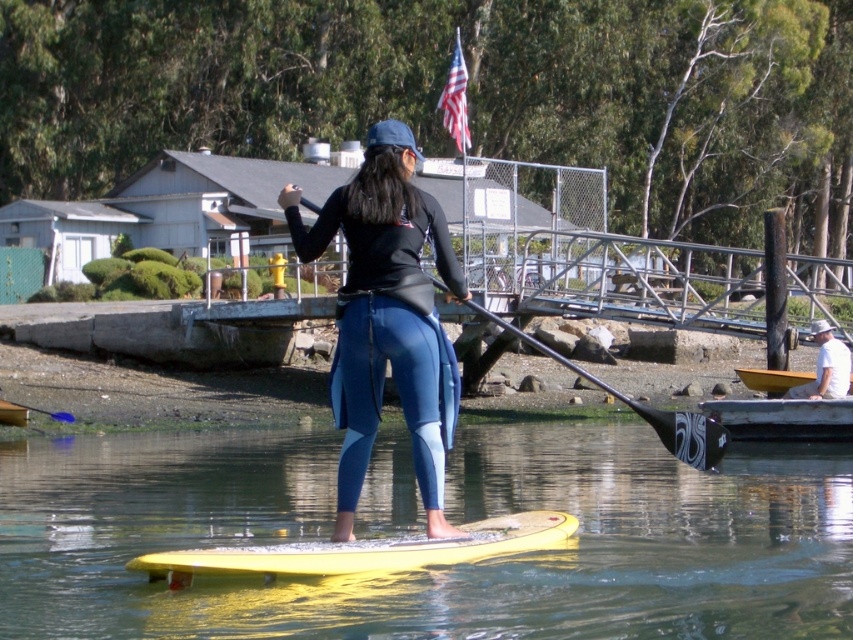
Looking at this image, which is more to the right, yellow rubber paddleboard at center or matte black wetsuit at center?

Positioned to the right is yellow rubber paddleboard at center.

Is yellow rubber paddleboard at center shorter than matte black wetsuit at center?

Indeed, yellow rubber paddleboard at center has a lesser height compared to matte black wetsuit at center.

The height and width of the screenshot is (640, 853). Describe the element at coordinates (451, 520) in the screenshot. I see `yellow rubber paddleboard at center` at that location.

Locate an element on the screen. yellow rubber paddleboard at center is located at coordinates (451, 520).

Does yellow plastic kayak at lower right have a greater width compared to black glossy paddle at center?

In fact, yellow plastic kayak at lower right might be narrower than black glossy paddle at center.

What do you see at coordinates (782, 419) in the screenshot?
I see `yellow plastic kayak at lower right` at bounding box center [782, 419].

Which is in front, point (709, 401) or point (700, 454)?

Positioned in front is point (700, 454).

Locate an element on the screen. The width and height of the screenshot is (853, 640). yellow plastic kayak at lower right is located at coordinates (782, 419).

Is black glossy paddle at center thinner than white cotton shirt at lower right?

No.

Can you confirm if black glossy paddle at center is smaller than white cotton shirt at lower right?

Actually, black glossy paddle at center might be larger than white cotton shirt at lower right.

Based on the photo, who is more forward, [688,433] or [813,323]?

Point [688,433] is in front.

Where is `black glossy paddle at center`? The width and height of the screenshot is (853, 640). black glossy paddle at center is located at coordinates (642, 406).